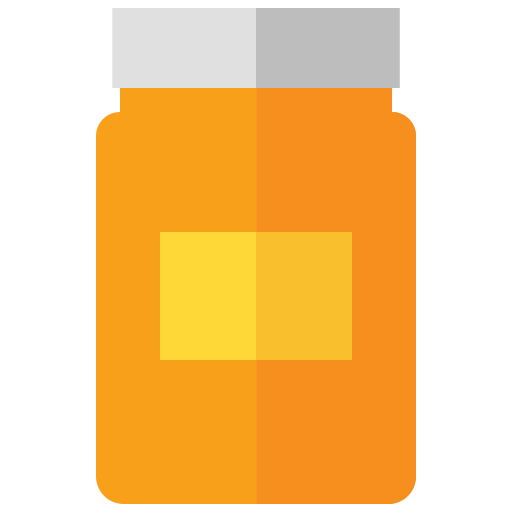
Find the location of a particular element. The height and width of the screenshot is (512, 512). rounded corners is located at coordinates (106, 117), (101, 492), (411, 493), (409, 120).